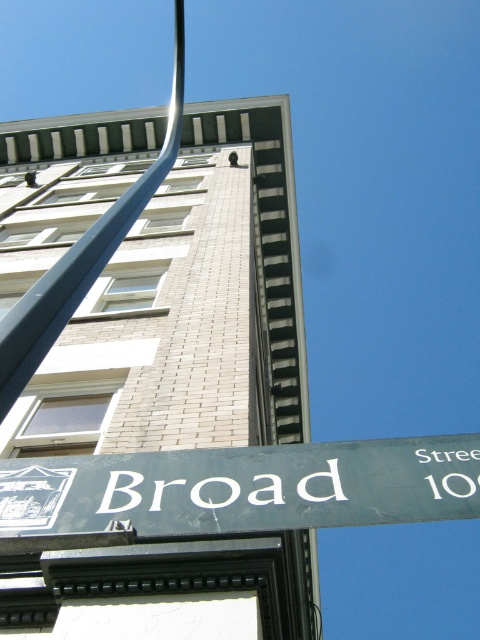
Question: Which of the following is the closest to the observer?

Choices:
 (A) (149, 480)
 (B) (17, 320)

Answer: (B)

Question: Is green matte street sign at lower center below blue metallic pole at upper left?

Choices:
 (A) no
 (B) yes

Answer: (B)

Question: Does green matte street sign at lower center appear on the right side of blue metallic pole at upper left?

Choices:
 (A) yes
 (B) no

Answer: (A)

Question: Is green matte street sign at lower center positioned at the back of blue metallic pole at upper left?

Choices:
 (A) no
 (B) yes

Answer: (B)

Question: Which object appears closest to the camera in this image?

Choices:
 (A) green matte street sign at lower center
 (B) blue metallic pole at upper left

Answer: (B)